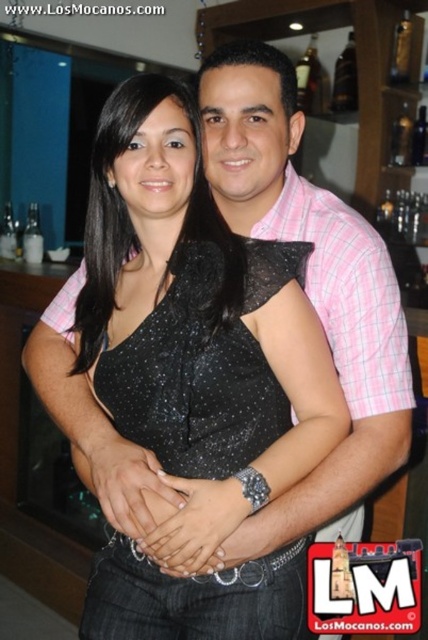
You are a photographer standing at point (297, 99). You want to take a photo of the two people holding hands. Can you capture them both in the frame without moving your position?

The two people holding hands are 3.40 meters apart from each other. Since the photographer is at point (297, 99), the distance between them might be too wide to capture both in the frame without moving. However, without knowing the camera lens specifications or the field of view, it is impossible to definitively answer. The question requires more information about the camera equipment.

You are a photographer setting up for a group photo in the described scene. You want to ensure both the black sequined dress at center and the shiny glass bottle at upper right are clearly visible. Based on their positions, where should you position the camera to capture both elements without one blocking the other?

The black sequined dress at center is located below the shiny glass bottle at upper right. To capture both without obstruction, position the camera so that the dress is framed below the bottle, ensuring the bottle is in the upper part of the frame and the dress is centered lower down.

In the scene shown: You are a bartender who needs to reach for a bottle. You see the dark brown glass bottle at upper center and the shiny glass bottle at upper right. Which bottle is closer to you?

The dark brown glass bottle at upper center is closer to you because it is further to the viewer than the shiny glass bottle at upper right.